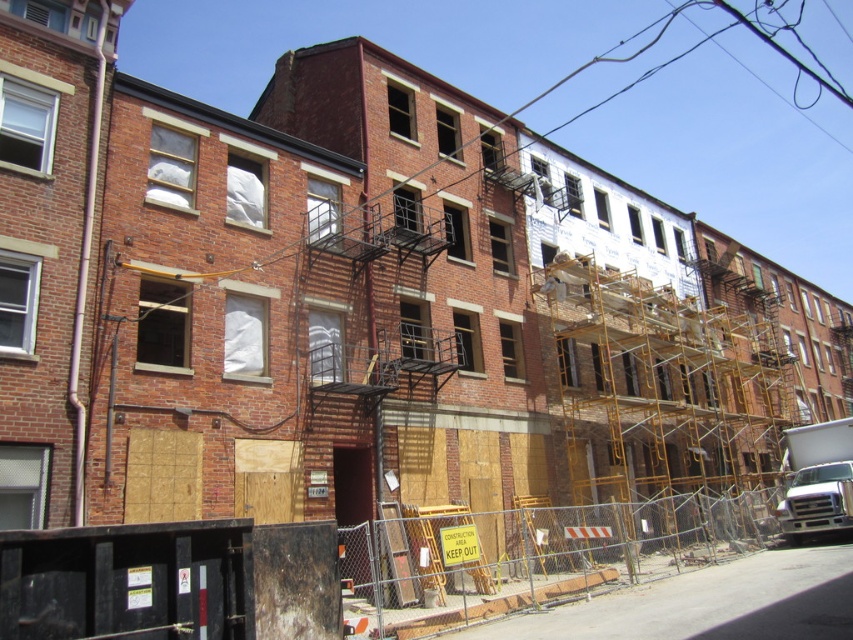
Question: Does yellow metal scaffolding at center appear on the right side of metal mesh fence at lower center?

Choices:
 (A) yes
 (B) no

Answer: (A)

Question: Is yellow metal scaffolding at center wider than metal mesh fence at lower center?

Choices:
 (A) no
 (B) yes

Answer: (B)

Question: Which of the following is the farthest from the observer?

Choices:
 (A) (700, 561)
 (B) (581, 356)

Answer: (B)

Question: Is yellow metal scaffolding at center to the right of metal mesh fence at lower center from the viewer's perspective?

Choices:
 (A) no
 (B) yes

Answer: (B)

Question: Which point is closer to the camera?

Choices:
 (A) metal mesh fence at lower center
 (B) yellow metal scaffolding at center

Answer: (A)

Question: Which object appears closest to the camera in this image?

Choices:
 (A) yellow metal scaffolding at center
 (B) metal mesh fence at lower center

Answer: (B)